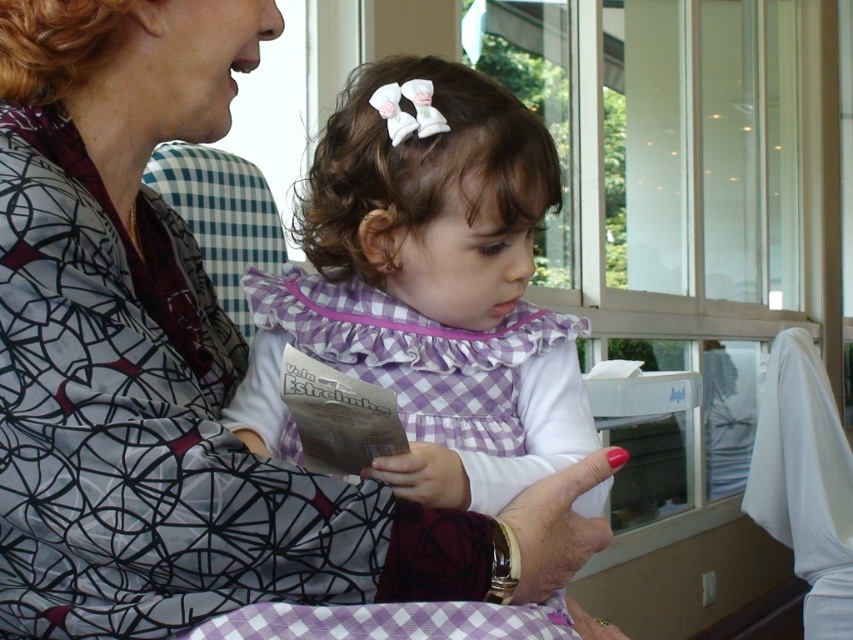
You are an observer looking at the scene. Which object is nearer to you, the matte black blouse at center or the purple checkered dress at center?

The matte black blouse at center is closer to the viewer than the purple checkered dress at center.

You are an architect designing a new building and need to place two structural supports at the coordinates of the two points in the image. The first point is at point [569,500] and the second is at point [346,186]. Since the supports must be placed at their exact coordinates, which support will be closer to the building entrance located at the front of the image?

Point [569,500] is closer to the viewer than point [346,186], so the support at point [569,500] will be closer to the entrance at the front of the image.

You are an observer looking at the scene described. Which object is positioned to the left of the other between the matte black blouse at center and the purple checkered dress at center?

The matte black blouse at center is to the left of the purple checkered dress at center.